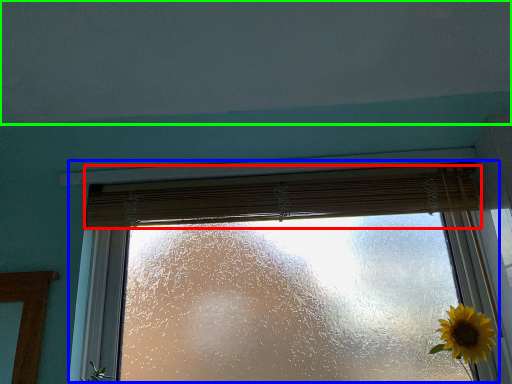
Question: Based on their relative distances, which object is nearer to curtain (highlighted by a red box)? Choose from window (highlighted by a blue box) and backdrop (highlighted by a green box).

Choices:
 (A) window
 (B) backdrop

Answer: (A)